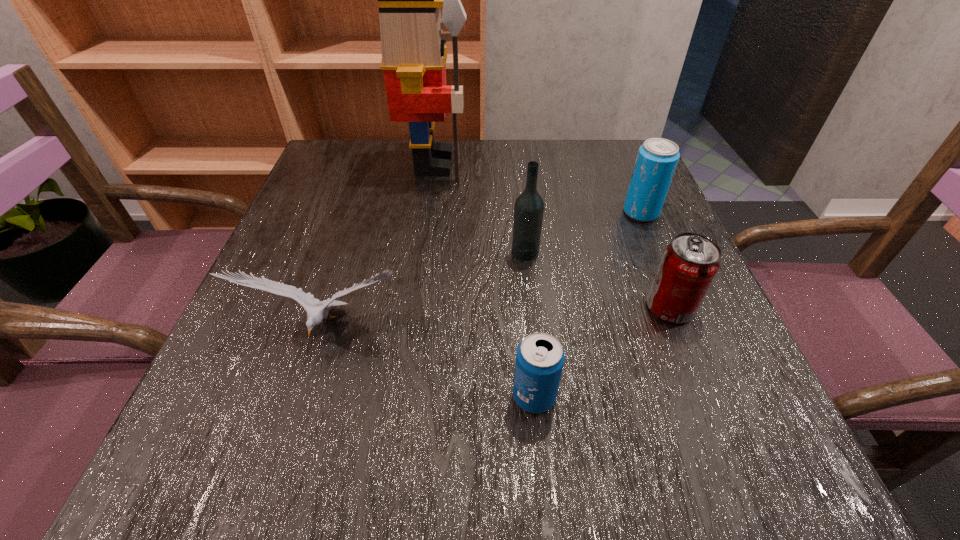
Find the location of `free area in between the second farthest soda can and the second tallest object`. free area in between the second farthest soda can and the second tallest object is located at coordinates (597, 280).

Where is `free space that is in between the tallest object and the second nearest soda can`? The width and height of the screenshot is (960, 540). free space that is in between the tallest object and the second nearest soda can is located at coordinates (552, 235).

You are a GUI agent. You are given a task and a screenshot of the screen. Output one action in this format:
    pyautogui.click(x=<x>, y=<y>)
    Task: Click on the vacant space in between the tallest object and the gull
    
    Given the screenshot: What is the action you would take?
    pyautogui.click(x=380, y=247)

Find the location of a particular element. This screenshot has width=960, height=540. unoccupied position between the fifth shortest object and the second nearest soda can is located at coordinates (597, 280).

Locate an element on the screen. This screenshot has height=540, width=960. object that is the fifth closest one to the gull is located at coordinates (657, 158).

Point out which object is positioned as the third nearest to the nearest object. Please provide its 2D coordinates. Your answer should be formatted as a tuple, i.e. [(x, y)], where the tuple contains the x and y coordinates of a point satisfying the conditions above.

[(529, 206)]

I want to click on soda can identified as the second closest to the shortest soda can, so click(657, 158).

Locate an element on the screen. This screenshot has width=960, height=540. soda can that is the closest to the shortest object is located at coordinates (689, 264).

Locate an element on the screen. This screenshot has width=960, height=540. vacant region that satisfies the following two spatial constraints: 1. in front of the farthest object holding the staff; 2. on the back side of the second nearest soda can is located at coordinates (414, 308).

Locate an element on the screen. Image resolution: width=960 pixels, height=540 pixels. free region that satisfies the following two spatial constraints: 1. in front of the tallest object holding the staff; 2. on the right side of the fifth nearest object is located at coordinates (427, 212).